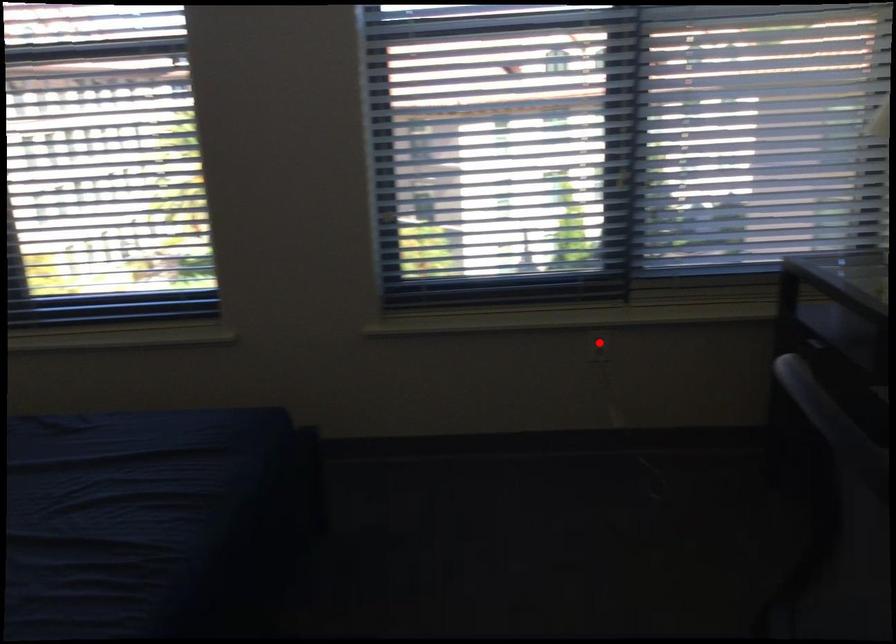
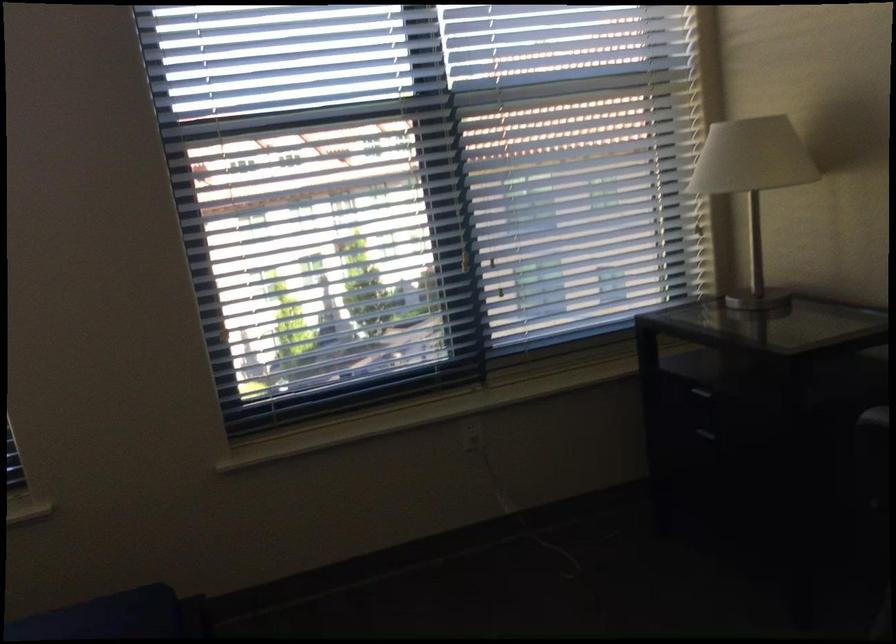
Find the pixel in the second image that matches the highlighted location in the first image.

(471, 433)